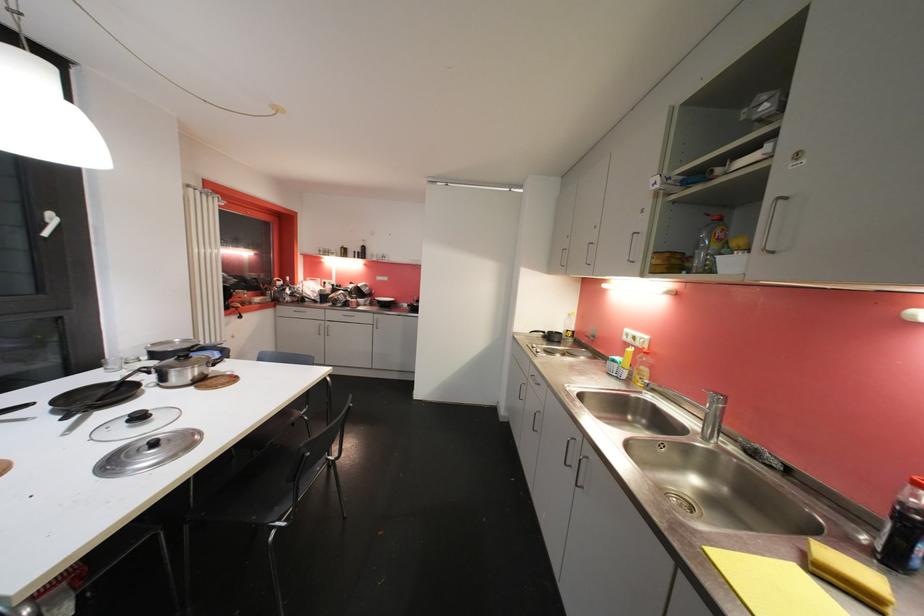
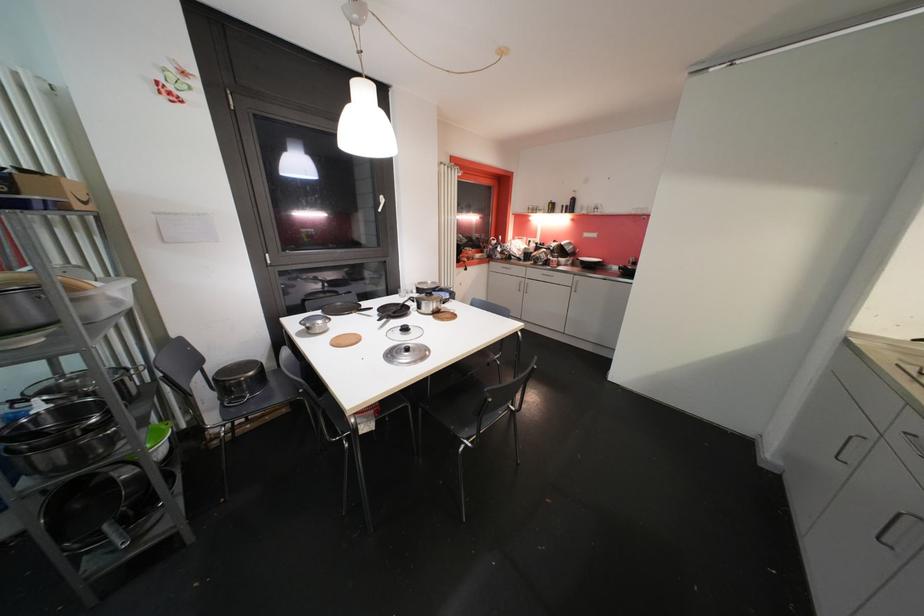
Locate, in the second image, the point that corresponds to point (372, 321) in the first image.

(572, 282)